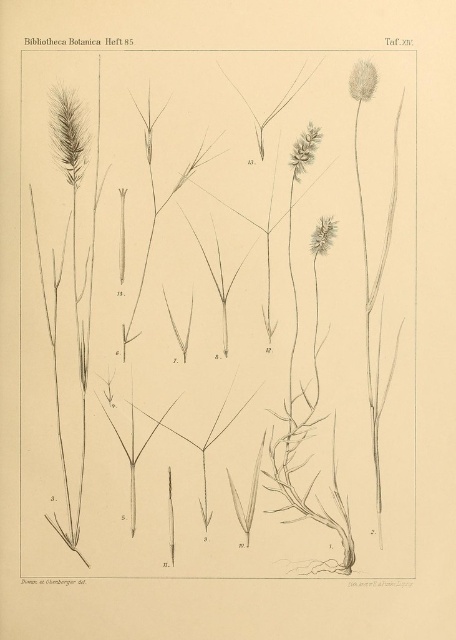
Question: Among these objects, which one is farthest from the camera?

Choices:
 (A) brown textured seed head at upper center
 (B) brown textured flower at center

Answer: (B)

Question: Which object is the farthest from the brown textured seed head at upper center?

Choices:
 (A) silvery textured seed head at upper right
 (B) brown textured flower at center

Answer: (B)

Question: In this image, where is brown textured seed head at upper center located relative to silvery textured seed head at upper right?

Choices:
 (A) left
 (B) right

Answer: (A)

Question: Is silvery textured seed head at upper right smaller than brown textured flower at center?

Choices:
 (A) yes
 (B) no

Answer: (B)

Question: Is brown textured seed head at upper center wider than brown textured flower at center?

Choices:
 (A) yes
 (B) no

Answer: (A)

Question: Which of these objects is positioned closest to the brown textured flower at center?

Choices:
 (A) silvery textured seed head at upper right
 (B) brown textured seed head at upper center

Answer: (B)